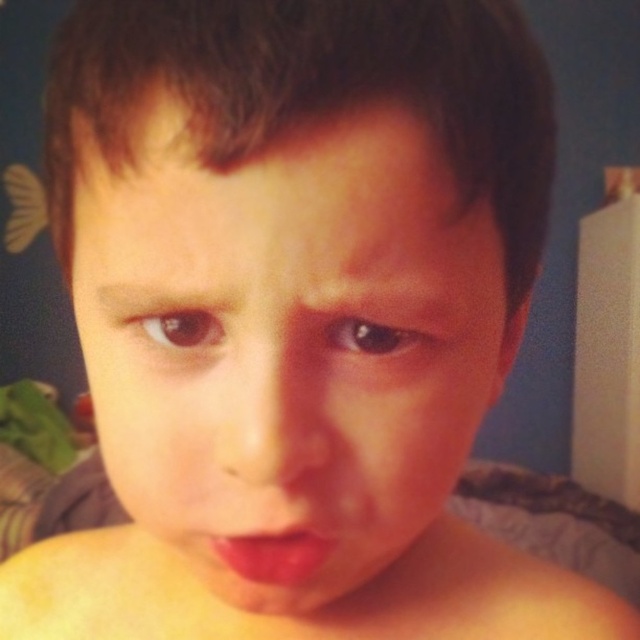
You are a photographer taking a portrait of a child. The child has a mole at point (259, 344). You want to place a sticker exactly 8.23 inches away from the mole to balance the composition. Where should you place the sticker?

The sticker should be placed 8.23 inches away from the mole at point (259, 344) to balance the composition.

Looking at this image, based on the scene description, which object occupies a larger area on the child face? Please choose between the smooth skin face at center and the matte pink lips at center.

The smooth skin face at center has a larger size compared to the matte pink lips at center, so the smooth skin face at center occupies a larger area on the child face.